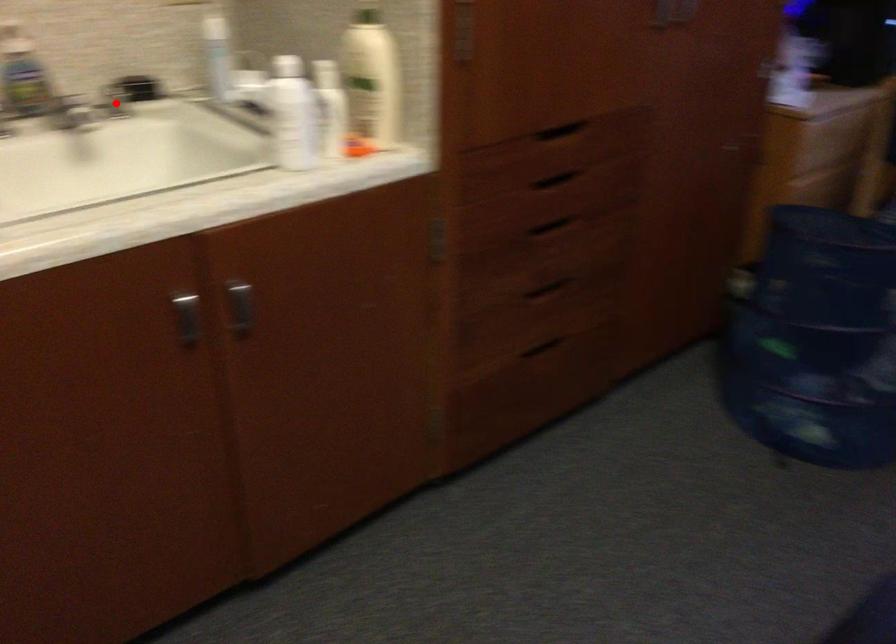
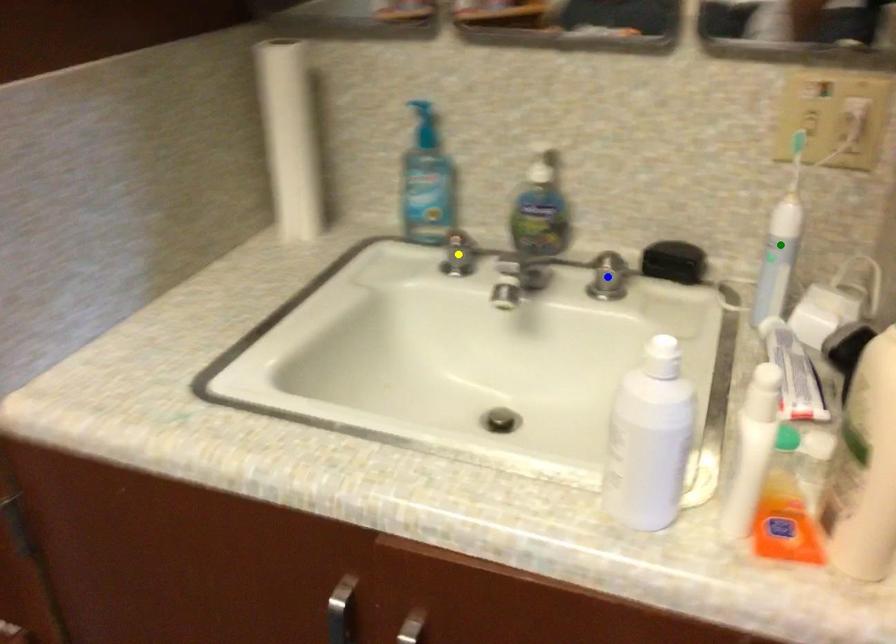
Question: I am providing you with two images of the same scene from different viewpoints. A red point is marked on the first image. You are given multiple points on the second image. Which point in image 2 represents the same 3d spot as the red point in image 1?

Choices:
 (A) blue point
 (B) yellow point
 (C) green point

Answer: (A)